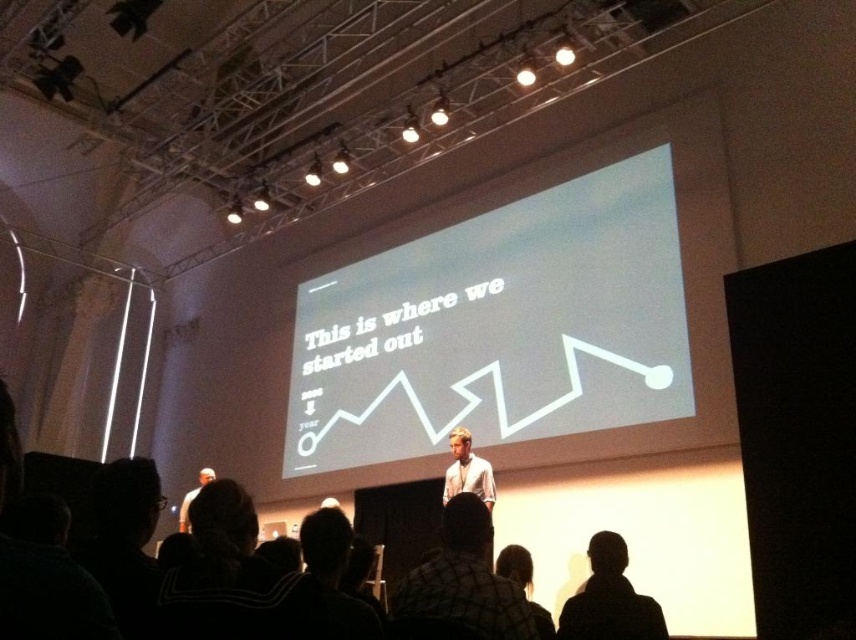
You are sitting in the front row of the conference hall and notice two elements in the scene. One is the white matte projection screen at upper center and the other is the black hair at lower center. Which of these two objects is closer to you?

The white matte projection screen at upper center is further to the viewer than black hair at lower center, so the black hair at lower center is closer to you.

You are sitting in the audience and notice two people on stage. One has dark hair at lower center and another wearing a white shirt at center. Which person is shorter?

The dark hair at lower center is shorter than the white shirt at center.